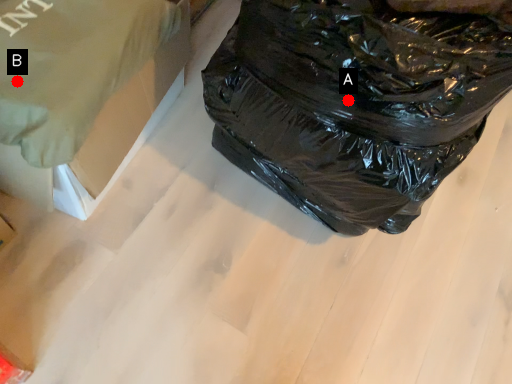
Question: Two points are circled on the image, labeled by A and B beside each circle. Which point is farther from the camera taking this photo?

Choices:
 (A) A is further
 (B) B is further

Answer: (A)